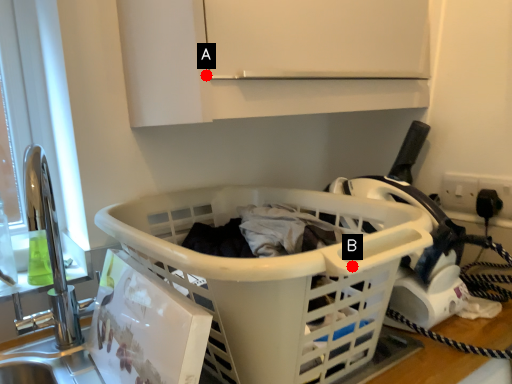
Question: Two points are circled on the image, labeled by A and B beside each circle. Among these points, which one is farthest from the camera?

Choices:
 (A) A is further
 (B) B is further

Answer: (A)